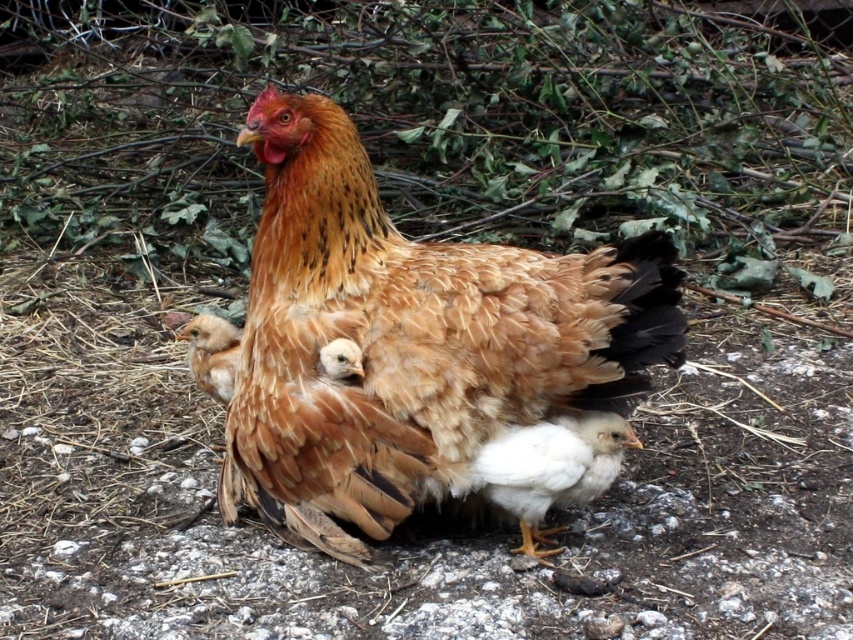
Which is above, brown feathered hen at center or brown fluffy chick at center?

Positioned higher is brown feathered hen at center.

Is point (347, 193) positioned behind point (235, 364)?

That is False.

Is point (546, 280) positioned in front of point (219, 372)?

That is True.

Identify the location of brown feathered hen at center. (409, 340).

From the picture: Is white fluffy chick at center shorter than brown fluffy chick at center?

Incorrect, white fluffy chick at center's height does not fall short of brown fluffy chick at center's.

Is point (491, 486) positioned after point (228, 323)?

That is False.

Does point (579, 460) lie in front of point (218, 323)?

That is True.

Locate an element on the screen. Image resolution: width=853 pixels, height=640 pixels. white fluffy chick at center is located at coordinates (x=550, y=468).

Can you confirm if brown feathered hen at center is shorter than white fluffy chick at center?

No, brown feathered hen at center is not shorter than white fluffy chick at center.

Between brown feathered hen at center and white fluffy chick at center, which one has less height?

With less height is white fluffy chick at center.

Is point (339, 154) more distant than point (634, 436)?

Yes, point (339, 154) is behind point (634, 436).

Where is `brown feathered hen at center`? brown feathered hen at center is located at coordinates (409, 340).